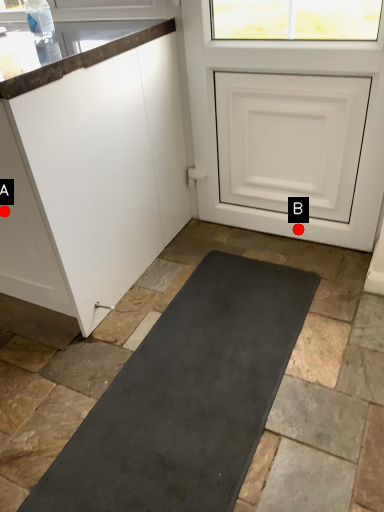
Question: Two points are circled on the image, labeled by A and B beside each circle. Which point appears closest to the camera in this image?

Choices:
 (A) A is closer
 (B) B is closer

Answer: (A)